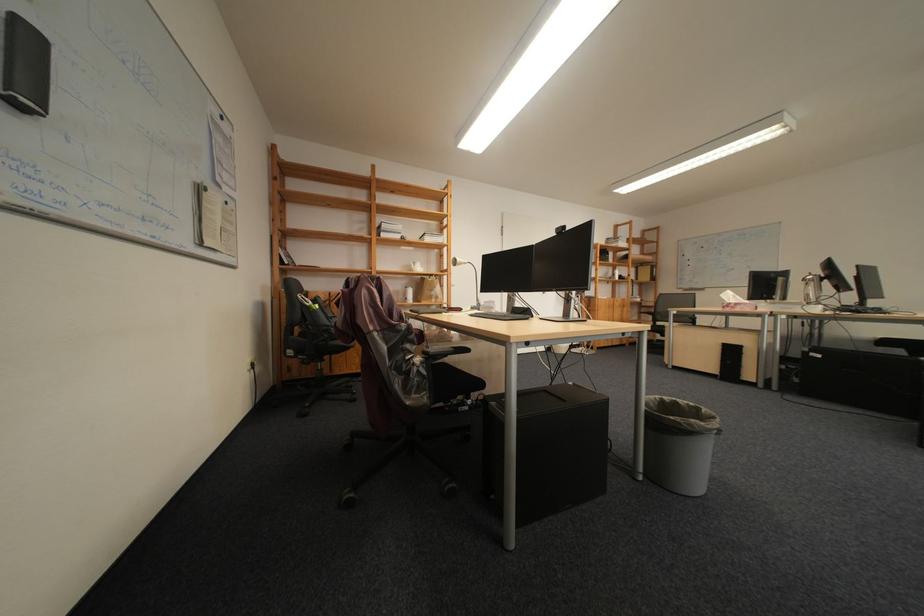
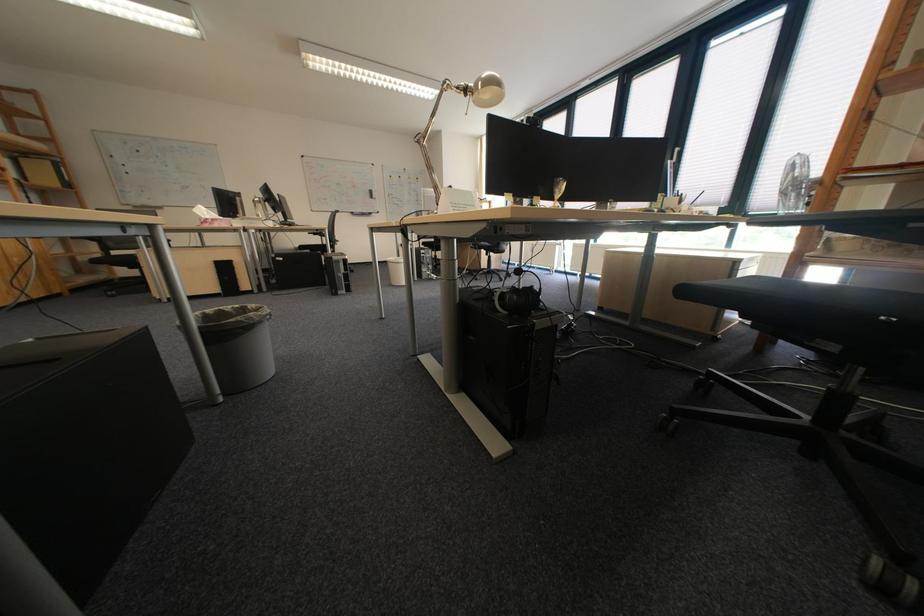
In the second image, find the point that corresponds to [747,309] in the first image.

(225, 225)